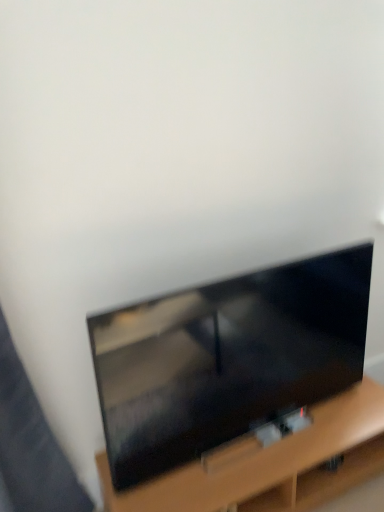
Question: Can you confirm if matte black tv at center is smaller than wooden tv stand at lower center?

Choices:
 (A) yes
 (B) no

Answer: (A)

Question: Is matte black tv at center oriented away from wooden tv stand at lower center?

Choices:
 (A) no
 (B) yes

Answer: (A)

Question: Is the surface of matte black tv at center in direct contact with wooden tv stand at lower center?

Choices:
 (A) no
 (B) yes

Answer: (A)

Question: Does matte black tv at center appear on the right side of wooden tv stand at lower center?

Choices:
 (A) yes
 (B) no

Answer: (B)

Question: Considering the relative positions of matte black tv at center and wooden tv stand at lower center in the image provided, is matte black tv at center in front of wooden tv stand at lower center?

Choices:
 (A) yes
 (B) no

Answer: (A)

Question: Considering the relative sizes of matte black tv at center and wooden tv stand at lower center in the image provided, is matte black tv at center taller than wooden tv stand at lower center?

Choices:
 (A) yes
 (B) no

Answer: (A)

Question: Are wooden tv stand at lower center and matte black tv at center beside each other?

Choices:
 (A) no
 (B) yes

Answer: (A)

Question: From the image's perspective, does wooden tv stand at lower center appear higher than matte black tv at center?

Choices:
 (A) no
 (B) yes

Answer: (A)

Question: Considering the relative sizes of wooden tv stand at lower center and matte black tv at center in the image provided, is wooden tv stand at lower center shorter than matte black tv at center?

Choices:
 (A) yes
 (B) no

Answer: (A)

Question: Can you confirm if wooden tv stand at lower center is thinner than matte black tv at center?

Choices:
 (A) yes
 (B) no

Answer: (B)

Question: Is wooden tv stand at lower center aimed at matte black tv at center?

Choices:
 (A) no
 (B) yes

Answer: (A)

Question: Is wooden tv stand at lower center taller than matte black tv at center?

Choices:
 (A) no
 (B) yes

Answer: (A)

Question: Relative to matte black tv at center, is wooden tv stand at lower center in front or behind?

Choices:
 (A) behind
 (B) front

Answer: (A)